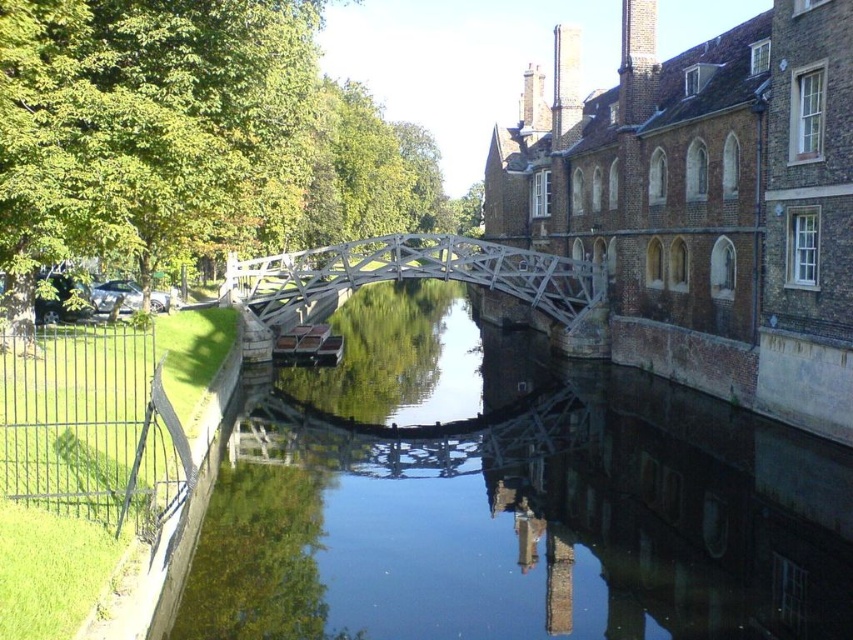
You are a tourist visiting the Mathematical Bridge at Queen College Cambridge University. You see the clear water at center and the white wooden bridge at center. Which object is positioned to the right side of the other?

The clear water at center is to the right of the white wooden bridge at center.